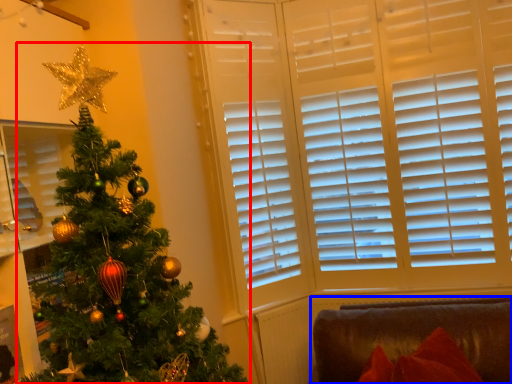
Question: Which object appears farthest to the camera in this image, christmas tree (highlighted by a red box) or furniture (highlighted by a blue box)?

Choices:
 (A) christmas tree
 (B) furniture

Answer: (B)